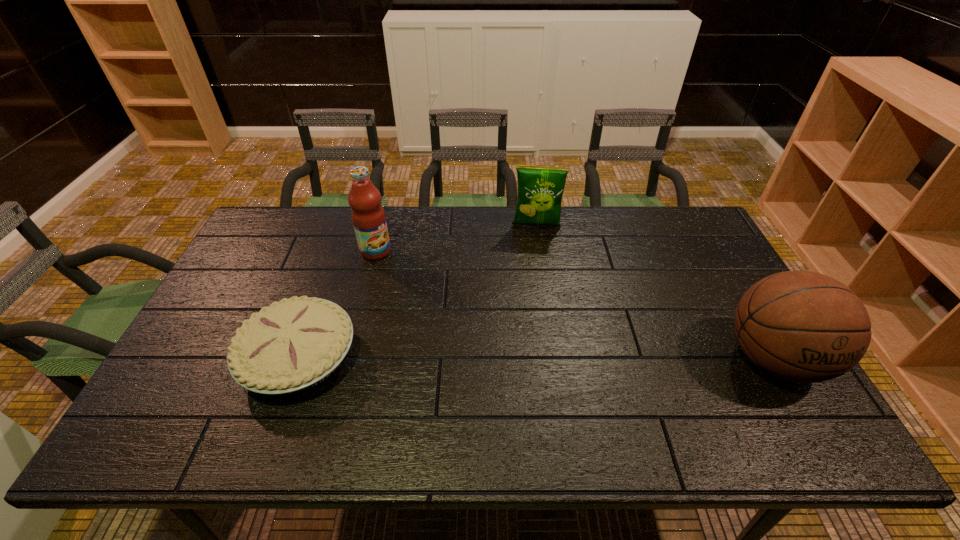
You are a GUI agent. You are given a task and a screenshot of the screen. Output one action in this format:
    pyautogui.click(x=<x>, y=<y>)
    Task: Click on the shortest object
    The width and height of the screenshot is (960, 540).
    Given the screenshot: What is the action you would take?
    pyautogui.click(x=294, y=344)

In order to click on the rightmost object in this screenshot , I will do `click(801, 326)`.

This screenshot has height=540, width=960. I want to click on fruit juice, so click(x=368, y=216).

Identify the location of the second object from right to left. [540, 188].

This screenshot has width=960, height=540. In order to click on the farthest object in this screenshot , I will do `click(540, 188)`.

This screenshot has width=960, height=540. Identify the location of free space located 0.090m on the right of the pie. (392, 356).

Find the location of a particular element. This screenshot has height=540, width=960. free space located 0.130m on the front label of the third nearest object is located at coordinates (414, 275).

Find the location of a particular element. This screenshot has width=960, height=540. blank area located on the front label of the third nearest object is located at coordinates (409, 273).

You are a GUI agent. You are given a task and a screenshot of the screen. Output one action in this format:
    pyautogui.click(x=<x>, y=<y>)
    Task: Click on the vacant position located on the front label of the third nearest object
    The height and width of the screenshot is (540, 960).
    Given the screenshot: What is the action you would take?
    pyautogui.click(x=409, y=273)

I want to click on free space located 0.320m on the front-facing side of the crisp (potato chip), so click(x=533, y=300).